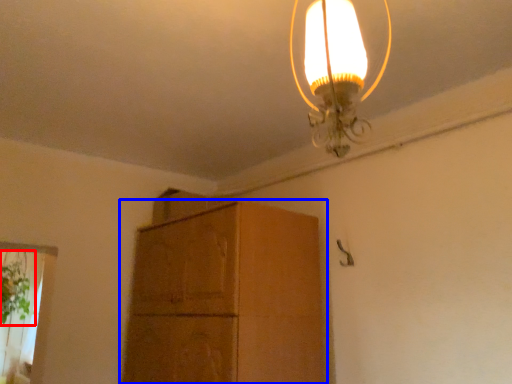
Question: Which of the following is the closest to the observer, plant (highlighted by a red box) or cabinetry (highlighted by a blue box)?

Choices:
 (A) plant
 (B) cabinetry

Answer: (B)